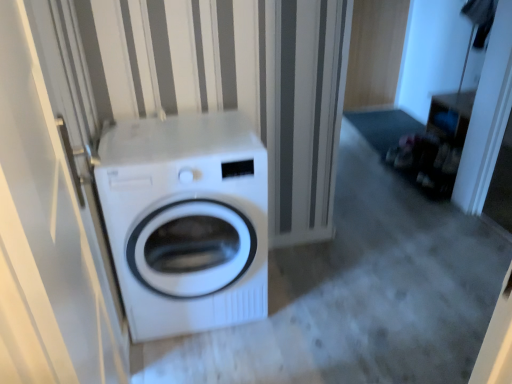
This screenshot has height=384, width=512. Describe the element at coordinates (44, 236) in the screenshot. I see `white glossy door at left` at that location.

Locate an element on the screen. white glossy door at left is located at coordinates (44, 236).

Looking at this image, in order to face white glossy washing machine at center, should I rotate leftwards or rightwards?

Rotate your view left by about 8.718°.

Describe the element at coordinates (186, 221) in the screenshot. I see `white glossy washing machine at center` at that location.

Where is `white glossy washing machine at center`? The image size is (512, 384). white glossy washing machine at center is located at coordinates (x=186, y=221).

This screenshot has width=512, height=384. I want to click on white glossy door at left, so click(x=44, y=236).

Visually, is white glossy washing machine at center positioned to the left or to the right of white glossy door at left?

Clearly, white glossy washing machine at center is on the right of white glossy door at left in the image.

In the image, is white glossy washing machine at center positioned in front of or behind white glossy door at left?

white glossy washing machine at center is behind white glossy door at left.

Considering the positions of points (150, 132) and (0, 257), is point (150, 132) closer to camera compared to point (0, 257)?

That is False.

From the image's perspective, between white glossy washing machine at center and white glossy door at left, who is located below?

white glossy door at left is shown below in the image.

From a real-world perspective, does white glossy washing machine at center stand above white glossy door at left?

No, from a real-world perspective, white glossy washing machine at center is not over white glossy door at left

Which object is wider, white glossy washing machine at center or white glossy door at left?

With larger width is white glossy washing machine at center.

Can you confirm if white glossy washing machine at center is shorter than white glossy door at left?

Yes, white glossy washing machine at center is shorter than white glossy door at left.

Does white glossy washing machine at center have a smaller size compared to white glossy door at left?

Incorrect, white glossy washing machine at center is not smaller in size than white glossy door at left.

Could white glossy door at left be considered to be inside white glossy washing machine at center?

No, white glossy washing machine at center does not contain white glossy door at left.

Does white glossy washing machine at center touch white glossy door at left?

They are not placed beside each other.

Could you tell me if white glossy washing machine at center is facing white glossy door at left?

Yes, white glossy washing machine at center is aimed at white glossy door at left.

This screenshot has height=384, width=512. In order to click on washing machine below the white glossy door at left (from a real-world perspective) in this screenshot , I will do `click(186, 221)`.

Which object is positioned more to the right, white glossy door at left or white glossy washing machine at center?

Positioned to the right is white glossy washing machine at center.

Is the depth of white glossy door at left greater than that of white glossy washing machine at center?

No, white glossy door at left is closer to the camera.

Which is more distant, (84, 235) or (103, 152)?

The point (103, 152) is farther from the camera.

From the image's perspective, which is below, white glossy door at left or white glossy washing machine at center?

white glossy door at left appears lower in the image.

From a real-world perspective, does white glossy door at left sit lower than white glossy washing machine at center?

No.

Is white glossy door at left wider or thinner than white glossy washing machine at center?

In the image, white glossy door at left appears to be more narrow than white glossy washing machine at center.

Between white glossy door at left and white glossy washing machine at center, which one has more height?

white glossy door at left is taller.

Based on the photo, which of these two, white glossy door at left or white glossy washing machine at center, is smaller?

white glossy door at left is smaller.

Is white glossy door at left outside of white glossy washing machine at center?

That's correct, white glossy door at left is outside of white glossy washing machine at center.

Is white glossy door at left far away from white glossy washing machine at center?

No.

Is white glossy door at left facing towards white glossy washing machine at center?

No, white glossy door at left is not oriented towards white glossy washing machine at center.

What's the angular difference between white glossy door at left and white glossy washing machine at center's facing directions?

95.7 degrees separate the facing orientations of white glossy door at left and white glossy washing machine at center.

How far apart are white glossy door at left and white glossy washing machine at center?

They are 27.07 inches apart.

Locate an element on the screen. The width and height of the screenshot is (512, 384). screen door on the left side of white glossy washing machine at center is located at coordinates (44, 236).

The image size is (512, 384). In order to click on washing machine above the white glossy door at left (from the image's perspective) in this screenshot , I will do `click(186, 221)`.

Where is `screen door on the left of white glossy washing machine at center`? screen door on the left of white glossy washing machine at center is located at coordinates (44, 236).